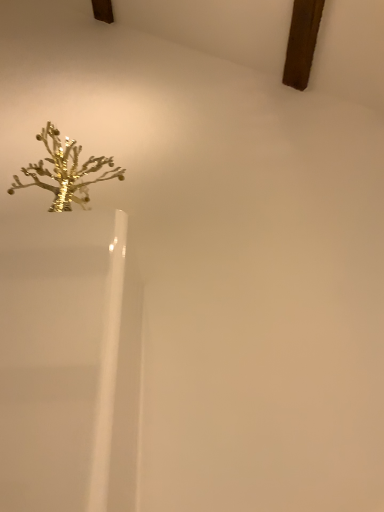
Where is `gold metallic tree at upper left`? The height and width of the screenshot is (512, 384). gold metallic tree at upper left is located at coordinates (66, 172).

The height and width of the screenshot is (512, 384). What do you see at coordinates (66, 172) in the screenshot?
I see `gold metallic tree at upper left` at bounding box center [66, 172].

Locate an element on the screen. The image size is (384, 512). gold metallic tree at upper left is located at coordinates (66, 172).